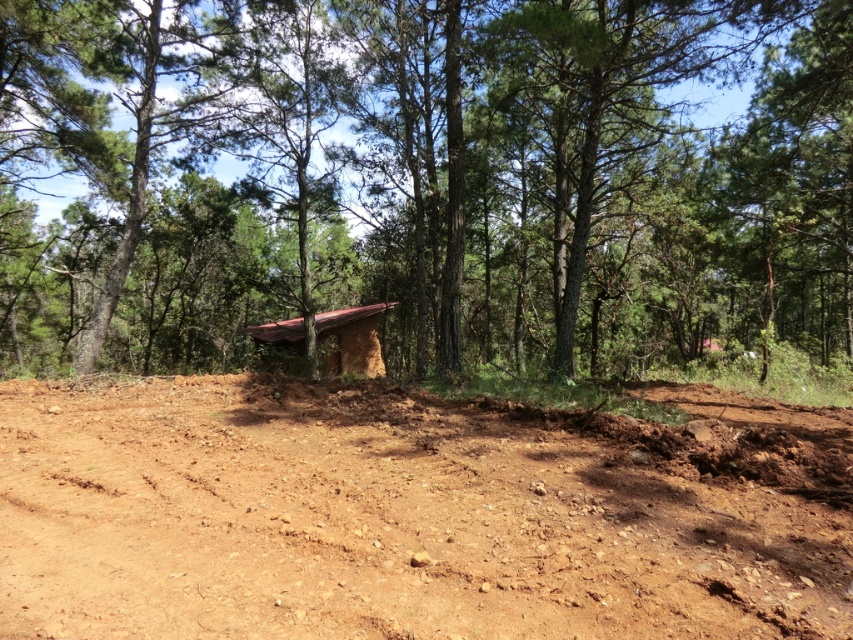
Is point (9, 294) closer to viewer compared to point (340, 339)?

No, it is not.

In the scene shown: Is brown textured hut at center thinner than brown mud hut at center?

In fact, brown textured hut at center might be wider than brown mud hut at center.

Where is `brown textured hut at center`? The height and width of the screenshot is (640, 853). brown textured hut at center is located at coordinates (433, 182).

Who is taller, brown textured hut at center or brown soil at center?

Standing taller between the two is brown textured hut at center.

Between brown textured hut at center and brown soil at center, which one appears on the left side from the viewer's perspective?

brown soil at center

Find the location of a particular element. The height and width of the screenshot is (640, 853). brown textured hut at center is located at coordinates (433, 182).

Is brown soil at center smaller than brown mud hut at center?

Correct, brown soil at center occupies less space than brown mud hut at center.

Consider the image. How distant is brown soil at center from brown mud hut at center?

brown soil at center and brown mud hut at center are 17.42 meters apart.

Locate an element on the screen. The width and height of the screenshot is (853, 640). brown soil at center is located at coordinates (410, 515).

Where is `brown soil at center`? brown soil at center is located at coordinates (410, 515).